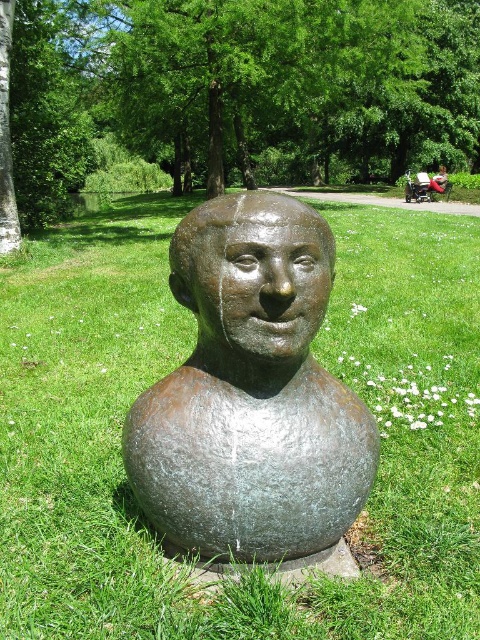
Question: Which object appears closest to the camera in this image?

Choices:
 (A) green leafy tree at center
 (B) green grass at center
 (C) rusty bronze head at center
 (D) bronze statue at center

Answer: (D)

Question: Can you confirm if bronze statue at center is thinner than rusty bronze head at center?

Choices:
 (A) yes
 (B) no

Answer: (B)

Question: Which is nearer to the rusty bronze head at center?

Choices:
 (A) bronze statue at center
 (B) green grass at center

Answer: (A)

Question: Does bronze statue at center appear on the right side of rusty bronze head at center?

Choices:
 (A) no
 (B) yes

Answer: (A)

Question: Observing the image, what is the correct spatial positioning of bronze statue at center in reference to rusty bronze head at center?

Choices:
 (A) above
 (B) below

Answer: (B)

Question: Considering the real-world distances, which object is farthest from the green grass at center?

Choices:
 (A) bronze statue at center
 (B) green leafy tree at center

Answer: (B)